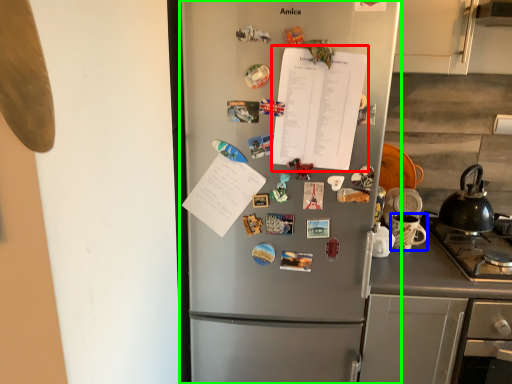
Question: Considering the real-world distances, which object is closest to notebook (highlighted by a red box)? appliance (highlighted by a blue box) or refrigerator (highlighted by a green box).

Choices:
 (A) appliance
 (B) refrigerator

Answer: (B)